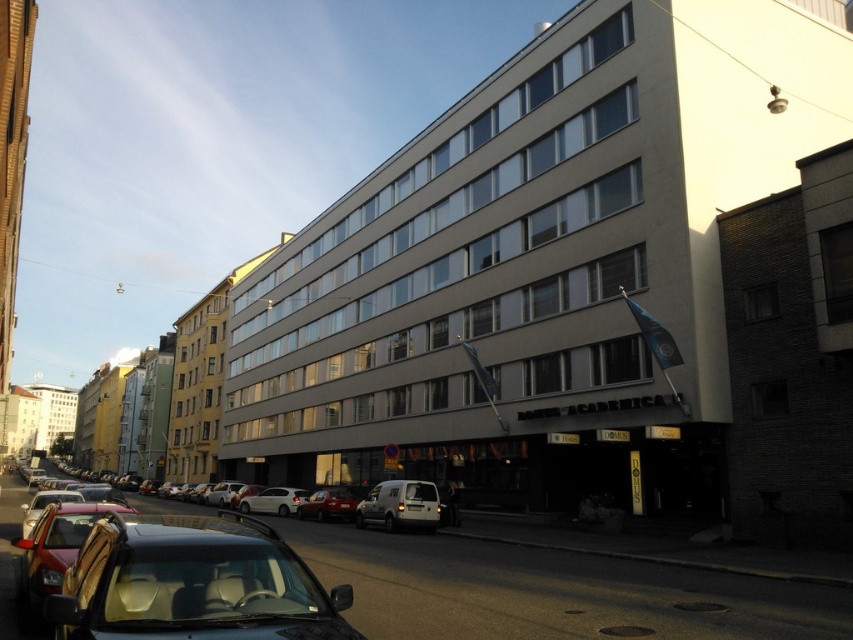
Question: Is matte silver hatchback at center bigger than white matte car at center?

Choices:
 (A) yes
 (B) no

Answer: (B)

Question: Which of the following is the farthest from the observer?

Choices:
 (A) (376, 500)
 (B) (352, 516)
 (C) (28, 566)

Answer: (B)

Question: Is the position of shiny red car at lower left less distant than that of white matte car at center?

Choices:
 (A) yes
 (B) no

Answer: (A)

Question: Can you confirm if white matte van at center is bigger than matte silver hatchback at center?

Choices:
 (A) no
 (B) yes

Answer: (A)

Question: Which object is farther from the camera taking this photo?

Choices:
 (A) shiny black car at lower left
 (B) white matte van at center
 (C) shiny red car at lower left
 (D) matte silver hatchback at center

Answer: (D)

Question: Estimate the real-world distances between objects in this image. Which object is closer to the shiny red car at lower left?

Choices:
 (A) matte silver hatchback at center
 (B) shiny black car at lower left
 (C) white matte van at center

Answer: (B)